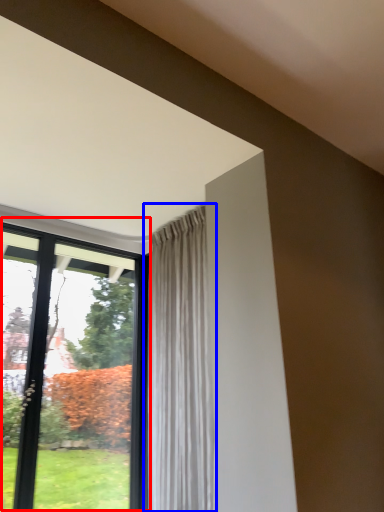
Question: Among these objects, which one is farthest to the camera, window (highlighted by a red box) or curtain (highlighted by a blue box)?

Choices:
 (A) window
 (B) curtain

Answer: (A)